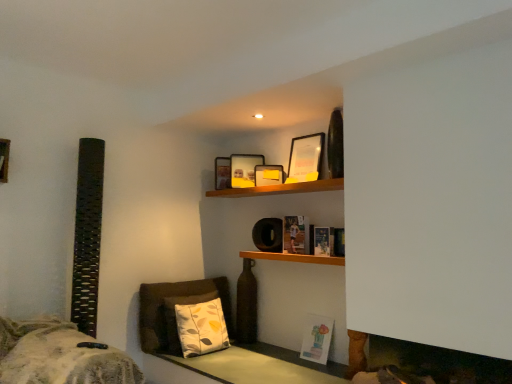
Question: Is hardcover book at center, the 2th book positioned from the top, not inside smooth wooden table at lower center?

Choices:
 (A) yes
 (B) no

Answer: (A)

Question: Is smooth wooden table at lower center at the back of hardcover book at center, the 2th book from the bottom?

Choices:
 (A) yes
 (B) no

Answer: (B)

Question: From the image's perspective, is hardcover book at center, the 2th book from the bottom, below smooth wooden table at lower center?

Choices:
 (A) no
 (B) yes

Answer: (A)

Question: Does hardcover book at center, the 2th book from the bottom, lie in front of smooth wooden table at lower center?

Choices:
 (A) no
 (B) yes

Answer: (A)

Question: From the image's perspective, is hardcover book at center, the 2th book from the bottom, on top of smooth wooden table at lower center?

Choices:
 (A) yes
 (B) no

Answer: (A)

Question: Considering the relative sizes of hardcover book at center, the 2th book positioned from the top, and smooth wooden table at lower center in the image provided, is hardcover book at center, the 2th book positioned from the top, bigger than smooth wooden table at lower center?

Choices:
 (A) no
 (B) yes

Answer: (A)

Question: Would you say white fabric pillow at lower center is outside fuzzy gray blanket at lower left?

Choices:
 (A) no
 (B) yes

Answer: (B)

Question: Considering the relative sizes of white fabric pillow at lower center and fuzzy gray blanket at lower left in the image provided, is white fabric pillow at lower center thinner than fuzzy gray blanket at lower left?

Choices:
 (A) yes
 (B) no

Answer: (A)

Question: Is white fabric pillow at lower center at the left side of fuzzy gray blanket at lower left?

Choices:
 (A) no
 (B) yes

Answer: (A)

Question: From the image's perspective, is white fabric pillow at lower center under fuzzy gray blanket at lower left?

Choices:
 (A) yes
 (B) no

Answer: (A)

Question: From a real-world perspective, does white fabric pillow at lower center stand above fuzzy gray blanket at lower left?

Choices:
 (A) no
 (B) yes

Answer: (B)

Question: Is white fabric pillow at lower center smaller than fuzzy gray blanket at lower left?

Choices:
 (A) no
 (B) yes

Answer: (B)

Question: Is matte yellow picture frame at upper center, which is the second picture frame from right to left, not within matte paper book at center, which is counted as the 1th book, starting from the top?

Choices:
 (A) no
 (B) yes

Answer: (B)